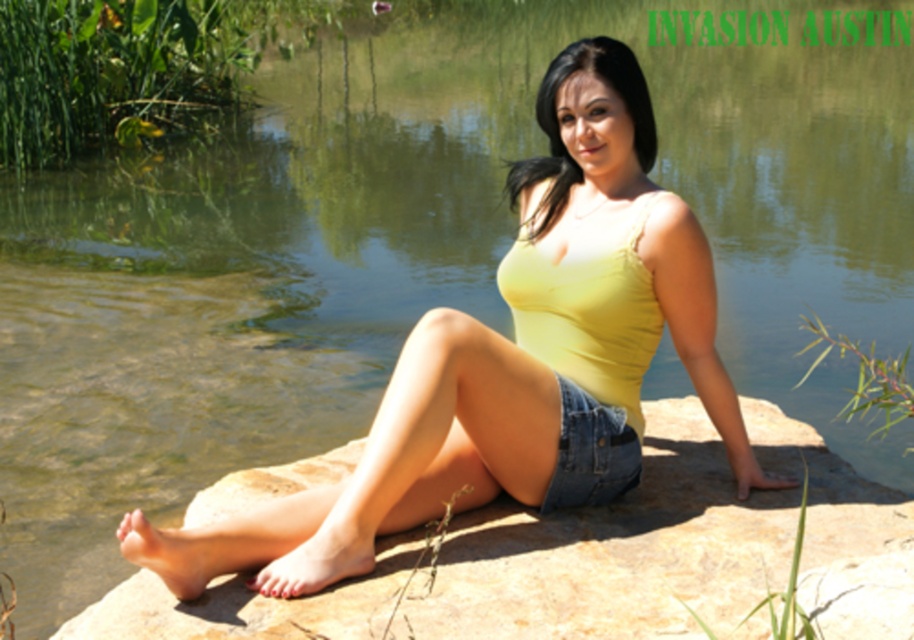
In the scene shown: Between yellow matte tank top at center and denim shorts at center, which one appears on the right side from the viewer's perspective?

Positioned to the right is denim shorts at center.

The image size is (914, 640). Describe the element at coordinates (392, 467) in the screenshot. I see `yellow matte tank top at center` at that location.

Is point (356, 488) positioned behind point (608, 477)?

No, (356, 488) is closer to viewer.

Locate an element on the screen. yellow matte tank top at center is located at coordinates tap(392, 467).

Between yellow matte tank top at center and brown textured rock at center, which one is positioned higher?

Positioned higher is yellow matte tank top at center.

Does yellow matte tank top at center appear over brown textured rock at center?

Indeed, yellow matte tank top at center is positioned over brown textured rock at center.

Which is behind, point (608, 84) or point (657, 528)?

Point (608, 84)

Locate an element on the screen. The image size is (914, 640). yellow matte tank top at center is located at coordinates (392, 467).

This screenshot has height=640, width=914. Find the location of `brown textured rock at center`. brown textured rock at center is located at coordinates (617, 552).

Does brown textured rock at center have a lesser height compared to denim shorts at center?

Incorrect, brown textured rock at center's height does not fall short of denim shorts at center's.

The height and width of the screenshot is (640, 914). Find the location of `brown textured rock at center`. brown textured rock at center is located at coordinates (617, 552).

Locate an element on the screen. brown textured rock at center is located at coordinates (617, 552).